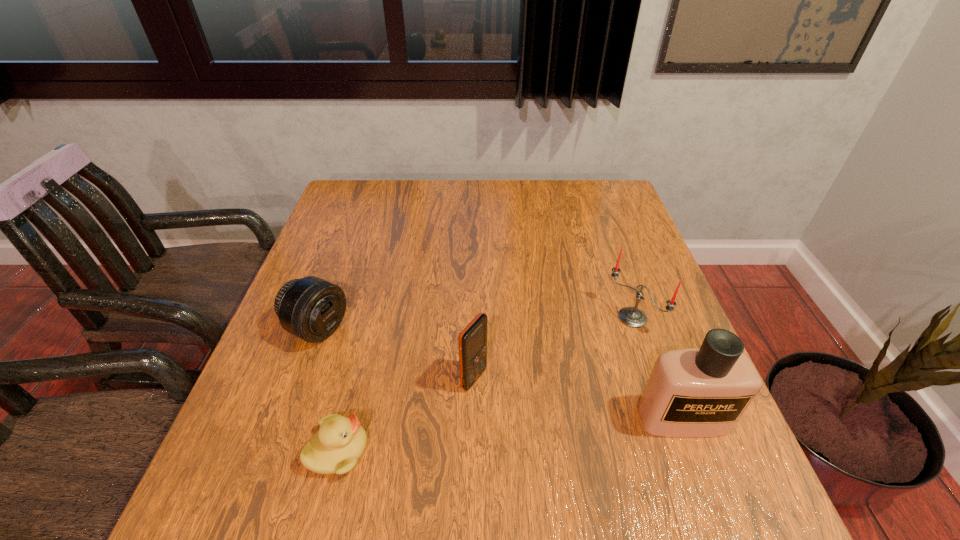
Find the location of a particular element. The width and height of the screenshot is (960, 540). vacant space on the desktop that is between the duckling and the perfume and is positioned on the front-facing side of the telephoto lens is located at coordinates click(528, 433).

Locate an element on the screen. The height and width of the screenshot is (540, 960). vacant space on the desktop that is between the shortest object and the tallest object and is positioned on the front-facing side of the candle is located at coordinates (496, 436).

Locate an element on the screen. The image size is (960, 540). free spot on the desktop that is between the shortest object and the tallest object and is positioned on the screen of the cellular telephone is located at coordinates (564, 430).